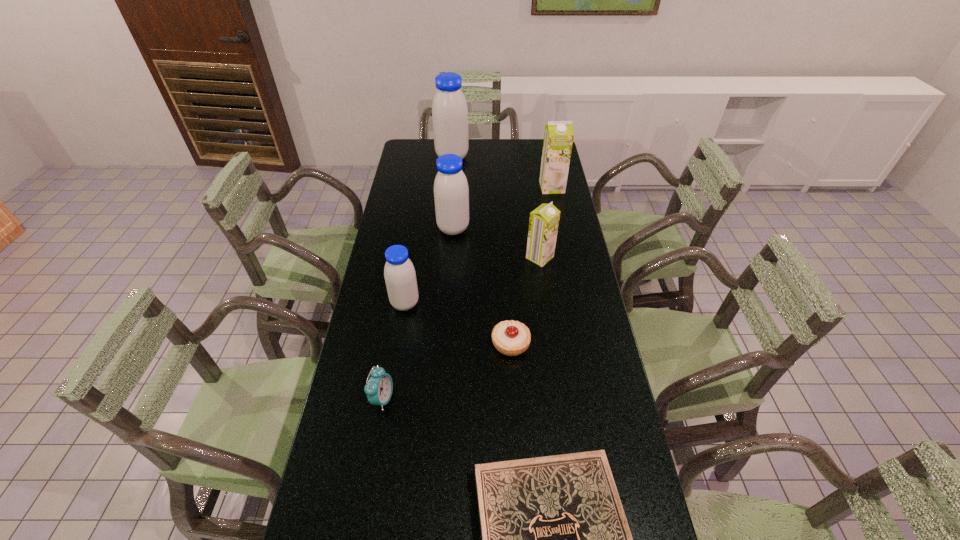
Locate an element on the screen. This screenshot has height=540, width=960. the tallest object is located at coordinates (449, 109).

Identify the location of the tallest soya milk. The height and width of the screenshot is (540, 960). (449, 109).

What are the coordinates of `the second farthest object` in the screenshot? It's located at (558, 137).

At what (x,y) coordinates should I click in order to perform the action: click on the bigger green soya milk. Please return your answer as a coordinate pair (x, y). This screenshot has width=960, height=540. Looking at the image, I should click on (558, 137).

At what (x,y) coordinates should I click in order to perform the action: click on the second smallest blue soya milk. Please return your answer as a coordinate pair (x, y). The width and height of the screenshot is (960, 540). Looking at the image, I should click on (451, 192).

Find the location of a particular element. the third farthest soya milk is located at coordinates (451, 192).

Identify the location of the fourth farthest object. (543, 224).

Find the location of a particular element. Image resolution: width=960 pixels, height=540 pixels. the smaller green soya milk is located at coordinates (543, 224).

This screenshot has width=960, height=540. Identify the location of the smallest blue soya milk. (399, 273).

At what (x,y) coordinates should I click in order to perform the action: click on the nearest blue soya milk. Please return your answer as a coordinate pair (x, y). Looking at the image, I should click on (399, 273).